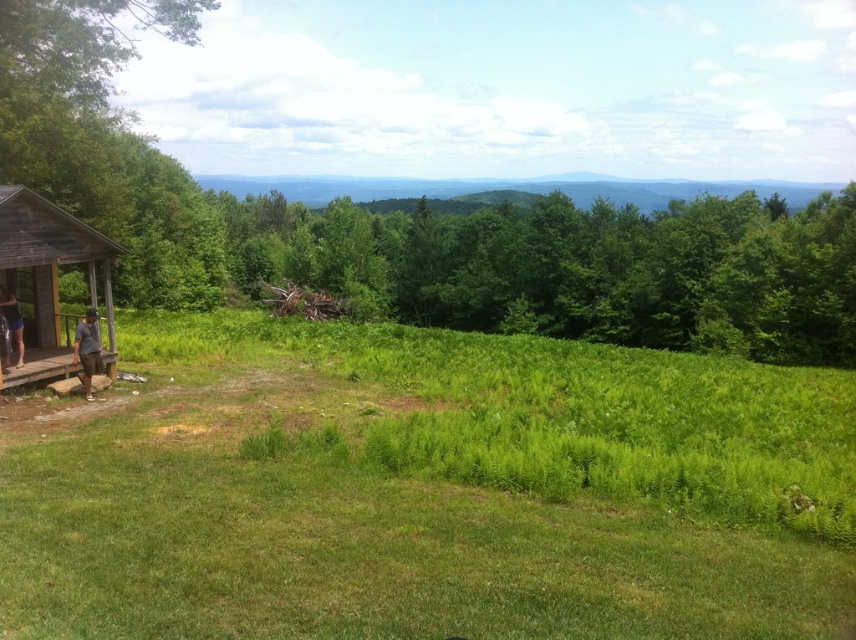
You are a visitor in this outdoor area and want to sit on the brown wooden porch at lower left. However, you notice the dark gray shirt at lower left nearby. Can you sit on the porch without the shirt getting in the way?

The brown wooden porch at lower left is not as tall as dark gray shirt at lower left, so the shirt is taller than the porch. Since the shirt is taller, it might block your view or access to the porch. Therefore, you might need to move the shirt out of the way before sitting.